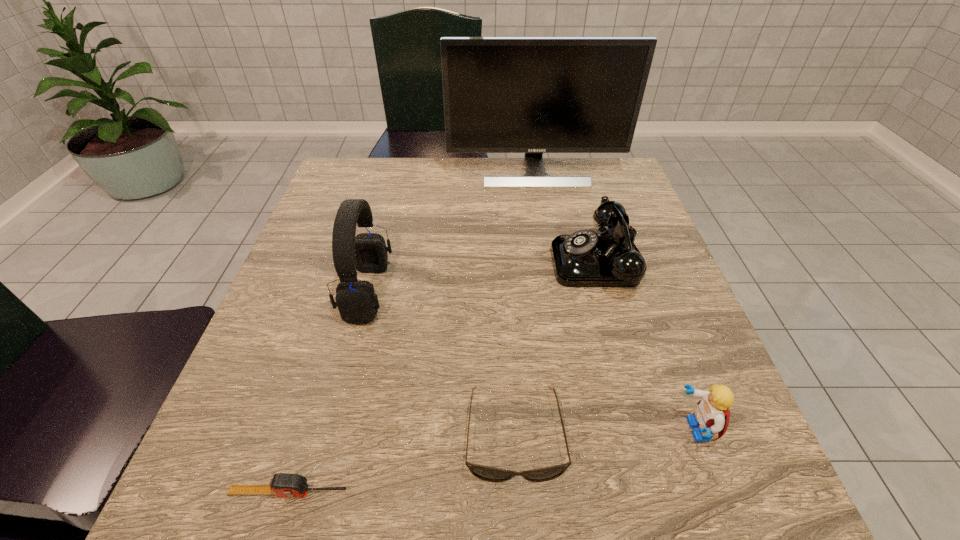
Locate an element on the screen. The height and width of the screenshot is (540, 960). the farthest object is located at coordinates (533, 95).

Locate an element on the screen. The image size is (960, 540). the tallest object is located at coordinates (533, 95).

Where is `the second tallest object`? the second tallest object is located at coordinates (356, 300).

The image size is (960, 540). What are the coordinates of `telephone` in the screenshot? It's located at [585, 258].

Locate an element on the screen. Lego is located at coordinates (711, 415).

The image size is (960, 540). In order to click on sunglasses in this screenshot , I will do `click(485, 473)`.

The height and width of the screenshot is (540, 960). I want to click on tape measure, so (x=282, y=484).

Locate an element on the screen. free spot located 0.230m on the screen side of the tallest object is located at coordinates (547, 242).

Where is `blank space located on the headband of the headset`? The height and width of the screenshot is (540, 960). blank space located on the headband of the headset is located at coordinates (508, 292).

Where is `vacant space located 0.230m on the dial of the telephone`? vacant space located 0.230m on the dial of the telephone is located at coordinates (446, 261).